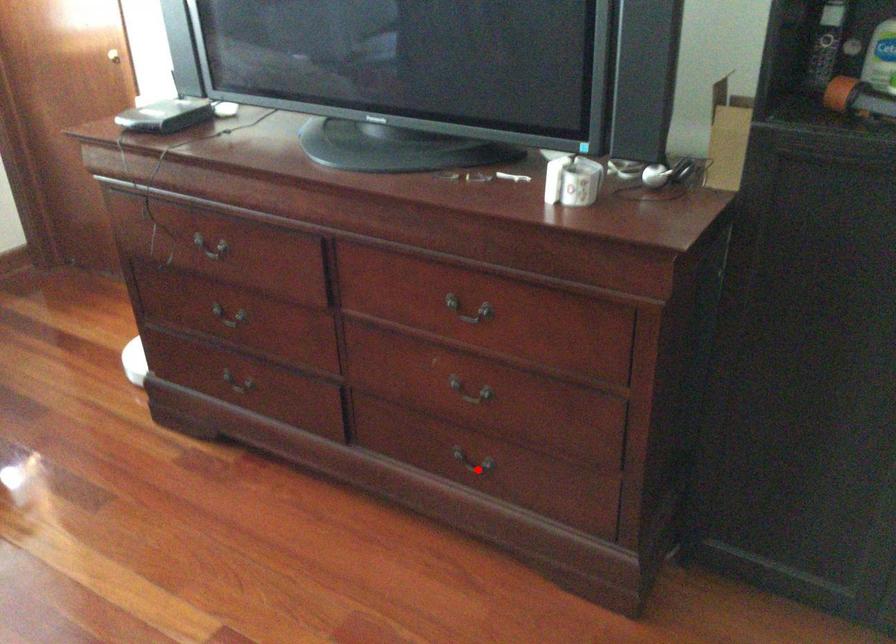
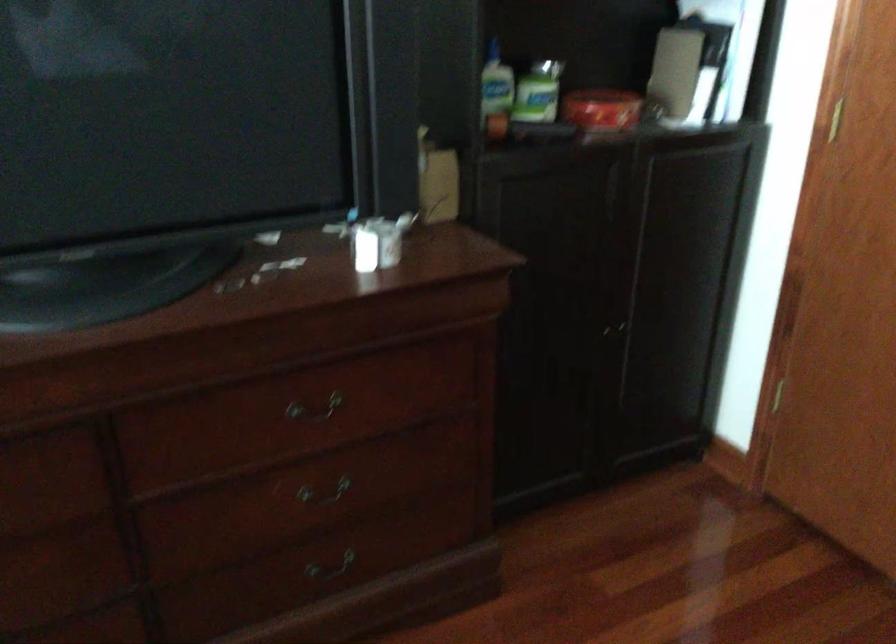
Where in the second image is the point corresponding to the highlighted location from the first image?

(330, 567)